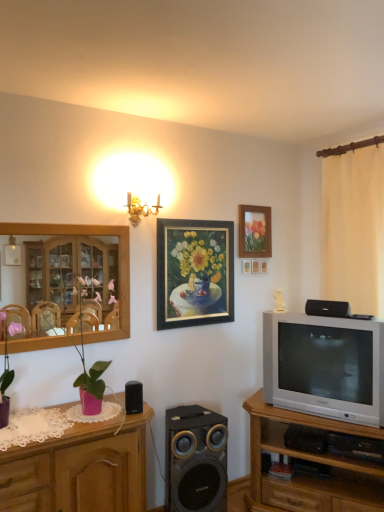
The image size is (384, 512). Describe the element at coordinates (119, 264) in the screenshot. I see `wooden cabinet at left` at that location.

Describe the element at coordinates (89, 368) in the screenshot. I see `pink matte vase at left, which is counted as the 2th plant, starting from the left` at that location.

This screenshot has height=512, width=384. Describe the element at coordinates (246, 266) in the screenshot. I see `wooden picture frame at upper center, which is the first picture frame from back to front` at that location.

This screenshot has width=384, height=512. I want to click on wooden cabinet at left, so click(x=119, y=264).

Locate an element on the screen. This screenshot has height=512, width=384. speaker that is the 2nd object to the right of the black matte speaker at lower center, which is the 2th speaker in bottom-to-top order, starting at the anchor is located at coordinates pos(327,308).

How many degrees apart are the facing directions of black matte speaker at lower center, positioned as the 1th speaker in left-to-right order, and black plastic speaker at right, arranged as the 3th speaker when viewed from the left?

They differ by 61.9 degrees in their facing directions.

Which object is positioned more to the right, black matte speaker at lower center, positioned as the 1th speaker in left-to-right order, or black plastic speaker at right, the first speaker viewed from the right?

black plastic speaker at right, the first speaker viewed from the right, is more to the right.

From a real-world perspective, who is located lower, black matte speaker at lower center, positioned as the 1th speaker in left-to-right order, or black plastic speaker at right, arranged as the 3th speaker when viewed from the left?

black matte speaker at lower center, positioned as the 1th speaker in left-to-right order, is physically lower.

Measure the distance from white sheer curtain at right to pink matte vase at left, placed as the first plant when sorted from right to left.

The distance of white sheer curtain at right from pink matte vase at left, placed as the first plant when sorted from right to left, is 6.46 feet.

From the image's perspective, relative to pink matte vase at left, placed as the first plant when sorted from right to left, is white sheer curtain at right above or below?

white sheer curtain at right is above pink matte vase at left, placed as the first plant when sorted from right to left.

Considering the relative sizes of white sheer curtain at right and pink matte vase at left, placed as the first plant when sorted from right to left, in the image provided, is white sheer curtain at right bigger than pink matte vase at left, placed as the first plant when sorted from right to left,?

Yes.

From a real-world perspective, between white sheer curtain at right and pink matte vase at left, which is counted as the 2th plant, starting from the left, who is vertically higher?

white sheer curtain at right is physically above.

From the image's perspective, is black matte speaker at lower center, the second speaker from the left, on top of wooden cabinet at left?

Answer: Incorrect, from the image's perspective, black matte speaker at lower center, the second speaker from the left, is lower than wooden cabinet at left.

Looking at this image, is black matte speaker at lower center, which ranks as the 1th speaker in bottom-to-top order, in front of wooden cabinet at left?

No, black matte speaker at lower center, which ranks as the 1th speaker in bottom-to-top order, is further to the viewer.

Between black matte speaker at lower center, the second speaker from the left, and wooden cabinet at left, which one has smaller width?

wooden cabinet at left is thinner.

Are silver metallic television at right and black matte speaker at lower center, positioned as the 1th speaker in left-to-right order, located far from each other?

Yes, silver metallic television at right and black matte speaker at lower center, positioned as the 1th speaker in left-to-right order, are quite far apart.

Considering the positions of objects silver metallic television at right and black matte speaker at lower center, which ranks as the 3th speaker in right-to-left order, in the image provided, who is more to the left, silver metallic television at right or black matte speaker at lower center, which ranks as the 3th speaker in right-to-left order,?

black matte speaker at lower center, which ranks as the 3th speaker in right-to-left order.

From the image's perspective, does silver metallic television at right appear lower than black matte speaker at lower center, positioned as the 1th speaker in left-to-right order?

No, from the image's perspective, silver metallic television at right is not below black matte speaker at lower center, positioned as the 1th speaker in left-to-right order.

The height and width of the screenshot is (512, 384). I want to click on speaker in front of the black matte speaker at lower center, which ranks as the 1th speaker in bottom-to-top order, so click(x=133, y=397).

Which object is closer to the camera, black matte speaker at lower center, which is the 2th speaker in bottom-to-top order, or black matte speaker at lower center, which ranks as the 1th speaker in bottom-to-top order?

black matte speaker at lower center, which is the 2th speaker in bottom-to-top order, is in front.

Would you say black matte speaker at lower center, which is the 2th speaker in top-to-bottom order, is to the left or to the right of black matte speaker at lower center, placed as the second speaker when sorted from right to left, in the picture?

black matte speaker at lower center, which is the 2th speaker in top-to-bottom order, is positioned on black matte speaker at lower center, placed as the second speaker when sorted from right to left,'s left side.

Is black matte speaker at lower center, which is the 2th speaker in top-to-bottom order, positioned far away from black matte speaker at lower center, placed as the second speaker when sorted from right to left?

They are positioned close to each other.

From a real-world perspective, which is physically below, matte purple pot at left, which ranks as the second plant in right-to-left order, or white sheer curtain at right?

From a 3D spatial view, matte purple pot at left, which ranks as the second plant in right-to-left order, is below.

Which is farther from the camera, [8,357] or [323,167]?

The point [323,167] is farther.

Does matte purple pot at left, which ranks as the second plant in right-to-left order, have a lesser width compared to white sheer curtain at right?

Indeed, matte purple pot at left, which ranks as the second plant in right-to-left order, has a lesser width compared to white sheer curtain at right.

Is matte purple pot at left, which ranks as the second plant in right-to-left order, oriented towards white sheer curtain at right?

No, matte purple pot at left, which ranks as the second plant in right-to-left order, is not oriented towards white sheer curtain at right.

Which object is positioned more to the left, wooden tv stand at right, acting as the 1th cabinetry starting from the right, or pink matte vase at left, which is counted as the 2th plant, starting from the left?

pink matte vase at left, which is counted as the 2th plant, starting from the left, is more to the left.

Between wooden tv stand at right, the 2th cabinetry from the left, and pink matte vase at left, placed as the first plant when sorted from right to left, which one has more height?

Standing taller between the two is wooden tv stand at right, the 2th cabinetry from the left.

Where is `the 2nd cabinetry below the pink matte vase at left, placed as the first plant when sorted from right to left (from a real-world perspective)`? This screenshot has height=512, width=384. the 2nd cabinetry below the pink matte vase at left, placed as the first plant when sorted from right to left (from a real-world perspective) is located at coordinates (312, 461).

From the image's perspective, relative to pink matte vase at left, placed as the first plant when sorted from right to left, is wooden tv stand at right, the 2th cabinetry from the left, above or below?

wooden tv stand at right, the 2th cabinetry from the left, is situated lower than pink matte vase at left, placed as the first plant when sorted from right to left, in the image.

Identify the location of the 2nd speaker in front of the black plastic speaker at right, the third speaker from the bottom. (133, 397).

Where is `the 1st plant directly beneath the white sheer curtain at right (from a real-world perspective)`? the 1st plant directly beneath the white sheer curtain at right (from a real-world perspective) is located at coordinates (89, 368).

From the picture: Based on their spatial positions, is pink wood cabinet at left, the second cabinetry positioned from the right, or black plastic speaker at right, arranged as the 3th speaker when viewed from the left, closer to pink matte vase at left, which is counted as the 2th plant, starting from the left?

pink wood cabinet at left, the second cabinetry positioned from the right.

When comparing their distances from black matte speaker at lower center, which is the 2th speaker in bottom-to-top order, does black plastic speaker at right, which appears as the 1th speaker when viewed from the top, or white sheer curtain at right seem further?

white sheer curtain at right lies further to black matte speaker at lower center, which is the 2th speaker in bottom-to-top order, than the other object.

Estimate the real-world distances between objects in this image. Which object is further from wooden tv stand at right, the 2th cabinetry from the left, pink matte vase at left, placed as the first plant when sorted from right to left, or black matte speaker at lower center, which is the third speaker in top-to-bottom order?

Among the two, pink matte vase at left, placed as the first plant when sorted from right to left, is located further to wooden tv stand at right, the 2th cabinetry from the left.

Which object lies nearer to the anchor point black matte speaker at lower center, the second speaker from the left, pink wood cabinet at left, which ranks as the 1th cabinetry in left-to-right order, or silver metallic television at right?

Based on the image, pink wood cabinet at left, which ranks as the 1th cabinetry in left-to-right order, appears to be nearer to black matte speaker at lower center, the second speaker from the left.

Which object lies nearer to the anchor point white sheer curtain at right, gold-framed painting at center, which ranks as the first picture frame in front-to-back order, or black matte speaker at lower center, positioned as the 1th speaker in left-to-right order?

gold-framed painting at center, which ranks as the first picture frame in front-to-back order.

Which object lies further to the anchor point black plastic speaker at right, the third speaker from the bottom, wooden tv stand at right, the 2th cabinetry from the left, or wooden picture frame at upper center, acting as the second picture frame starting from the left?

wooden tv stand at right, the 2th cabinetry from the left.

Looking at the image, which one is located further to white sheer curtain at right, black matte speaker at lower center, which ranks as the 3th speaker in right-to-left order, or wooden picture frame at upper center, which is the first picture frame from back to front?

Among the two, black matte speaker at lower center, which ranks as the 3th speaker in right-to-left order, is located further to white sheer curtain at right.

From the image, which object appears to be farther from pink matte vase at left, which is counted as the 2th plant, starting from the left, pink wood cabinet at left, the second cabinetry positioned from the right, or black matte speaker at lower center, which is the 2th speaker in top-to-bottom order?

pink wood cabinet at left, the second cabinetry positioned from the right, lies further to pink matte vase at left, which is counted as the 2th plant, starting from the left, than the other object.

In order to click on speaker between gold-framed painting at center, the 3th picture frame positioned from the back, and white sheer curtain at right, in the horizontal direction in this screenshot , I will do `click(327, 308)`.

In order to click on entertainment center located between matte purple pot at left, the 1th plant when ordered from left to right, and wooden picture frame at upper center, acting as the second picture frame starting from the left, in the left-right direction in this screenshot , I will do `click(119, 264)`.

I want to click on plant situated between wooden cabinet at left and wooden picture frame at upper center, the 3th picture frame from the front, from left to right, so (x=89, y=368).

Where is `cabinetry located between pink matte vase at left, placed as the first plant when sorted from right to left, and white sheer curtain at right in the left-right direction`? This screenshot has width=384, height=512. cabinetry located between pink matte vase at left, placed as the first plant when sorted from right to left, and white sheer curtain at right in the left-right direction is located at coordinates (312, 461).